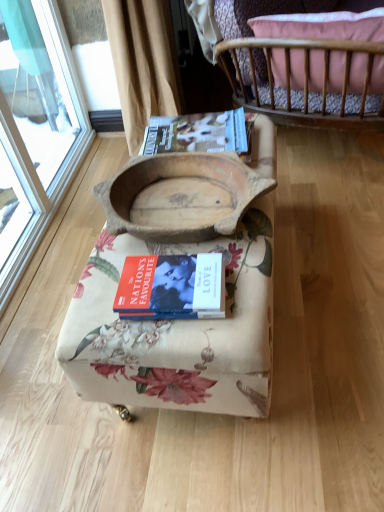
Find the location of a particular element. This screenshot has width=384, height=512. empty space that is ontop of hardcover book at center (from a real-world perspective) is located at coordinates (168, 276).